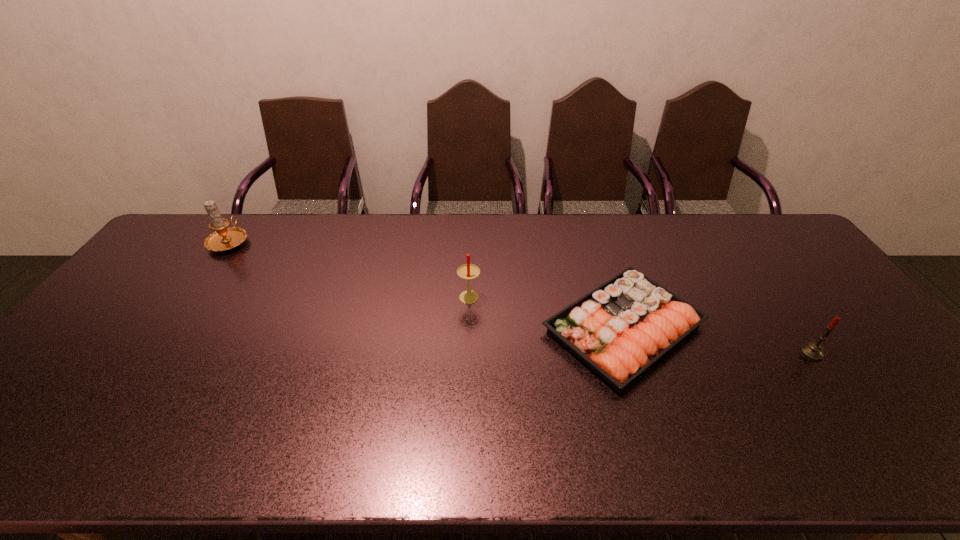
Find the location of a particular element. The width and height of the screenshot is (960, 540). the leftmost candle is located at coordinates (223, 239).

Image resolution: width=960 pixels, height=540 pixels. I want to click on the farthest object, so click(223, 239).

Identify the location of the second farthest candle. (468, 271).

You are a GUI agent. You are given a task and a screenshot of the screen. Output one action in this format:
    pyautogui.click(x=<x>, y=<y>)
    Task: Click on the third object from right to left
    This screenshot has width=960, height=540.
    Given the screenshot: What is the action you would take?
    pyautogui.click(x=468, y=271)

At what (x,y) coordinates should I click in order to perform the action: click on the nearest candle. Please return your answer as a coordinate pair (x, y). The image size is (960, 540). Looking at the image, I should click on (813, 350).

You are a GUI agent. You are given a task and a screenshot of the screen. Output one action in this format:
    pyautogui.click(x=<x>, y=<y>)
    Task: Click on the third tallest object
    
    Given the screenshot: What is the action you would take?
    pyautogui.click(x=813, y=350)

Find the location of `the shortest object`. the shortest object is located at coordinates (619, 329).

You are a GUI agent. You are given a task and a screenshot of the screen. Output one action in this format:
    pyautogui.click(x=<x>, y=<y>)
    Task: Click on the third object from left to right
    
    Given the screenshot: What is the action you would take?
    pyautogui.click(x=619, y=329)

I want to click on free region located on the front of the leftmost candle, so tap(183, 309).

I want to click on vacant space located 0.170m on the front of the second candle from right to left, so click(468, 352).